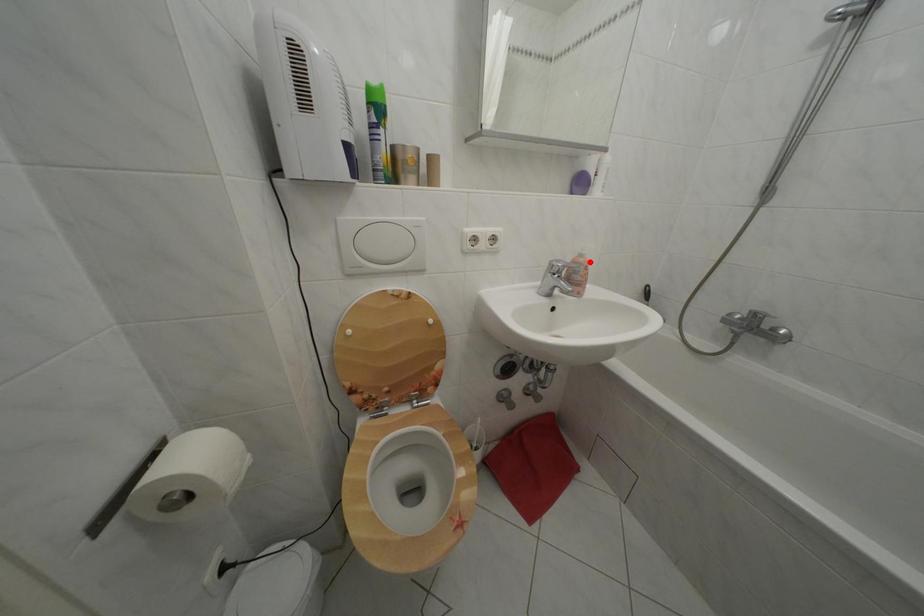
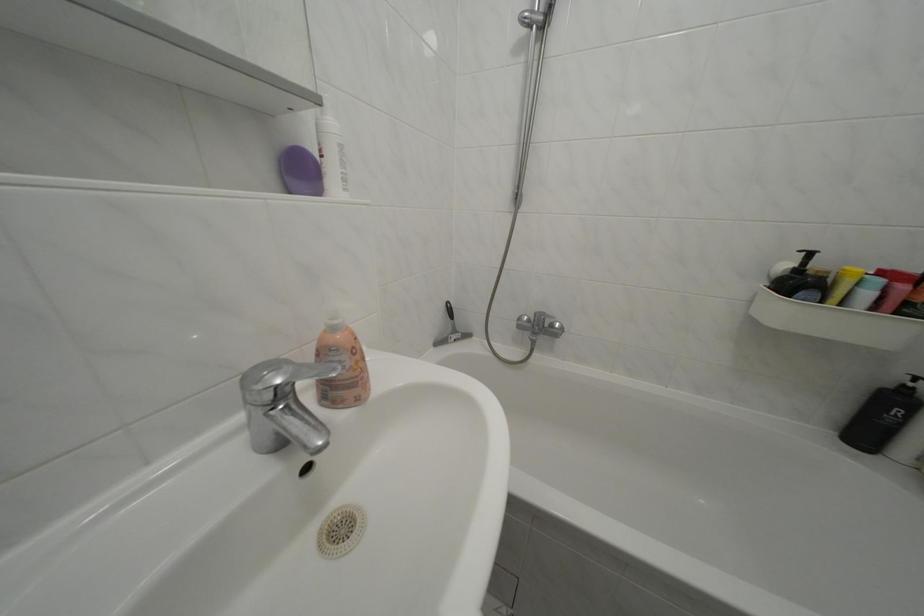
Where in the second image is the point corresponding to the highlighted location from the first image?

(342, 334)